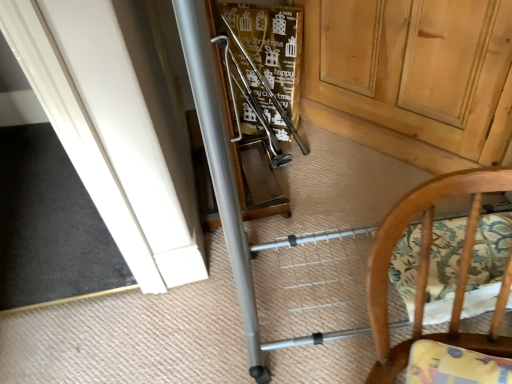
Question: Is wooden chair at lower right bigger or smaller than wooden door at center?

Choices:
 (A) big
 (B) small

Answer: (B)

Question: In the image, is wooden chair at lower right positioned in front of or behind wooden door at center?

Choices:
 (A) behind
 (B) front

Answer: (B)

Question: Looking at their shapes, would you say wooden chair at lower right is wider or thinner than wooden door at center?

Choices:
 (A) wide
 (B) thin

Answer: (B)

Question: In terms of height, does wooden door at center look taller or shorter compared to wooden chair at lower right?

Choices:
 (A) tall
 (B) short

Answer: (A)

Question: Considering their positions, is wooden door at center located in front of or behind wooden chair at lower right?

Choices:
 (A) front
 (B) behind

Answer: (B)

Question: Is point (416, 117) closer or farther from the camera than point (419, 286)?

Choices:
 (A) farther
 (B) closer

Answer: (A)

Question: Is wooden door at center wider or thinner than wooden chair at lower right?

Choices:
 (A) wide
 (B) thin

Answer: (A)